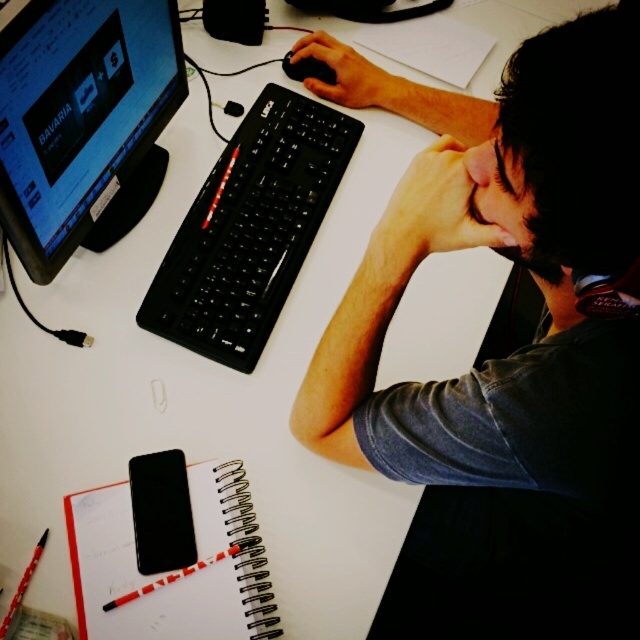
You are organizing items on the desk and need to place a new item between the skinny red pen at upper center and the black matte mouse at upper center. Is there enough space between them to fit a 3cm wide item?

The skinny red pen at upper center is to the right of the black matte mouse at upper center, so there is space between them. Since the item is only 3cm wide, it should fit between them.

You are standing in front of the desk shown in the image. There is a point at coordinate (632, 388) on the desk. If you want to place a 12 inch long ruler from this point towards the edge of the desk, will the ruler fit entirely on the desk without hanging off?

The distance from the point at (632, 388) to the viewer is 22.26 inches. Since the ruler is 12 inches long, placing it from this point towards the edge would leave enough space as 22.26 inches is greater than 12 inches. Thus, the ruler will fit entirely on the desk.

You are a person sitting at the desk in the image. You want to place a small sticker exactly at the point marked by the coordinates point (250,228). Where on the desk should you place the sticker?

The point (250,228) is on the black plastic keyboard at center, so you should place the sticker on the black plastic keyboard at center.